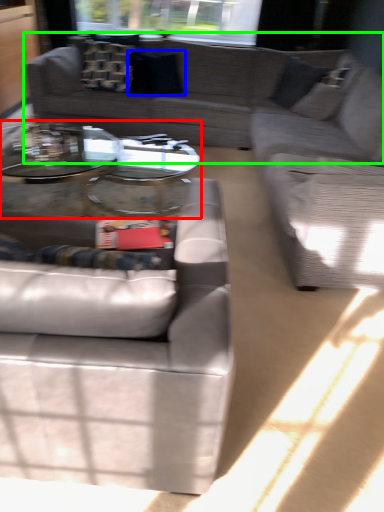
Question: Which object is positioned closest to coffee table (highlighted by a red box)? Select from pillow (highlighted by a blue box) and studio couch (highlighted by a green box).

Choices:
 (A) pillow
 (B) studio couch

Answer: (B)